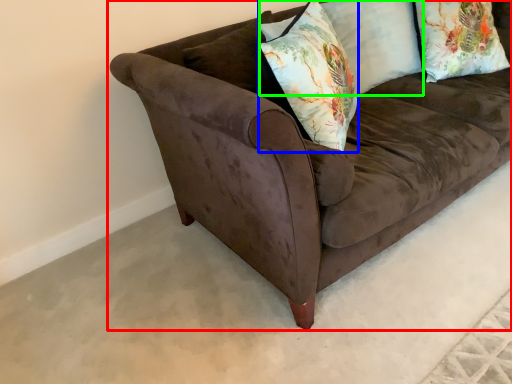
Question: Which object is the farthest from studio couch (highlighted by a red box)? Choose among these: throw pillow (highlighted by a blue box) or pillow (highlighted by a green box).

Choices:
 (A) throw pillow
 (B) pillow

Answer: (B)